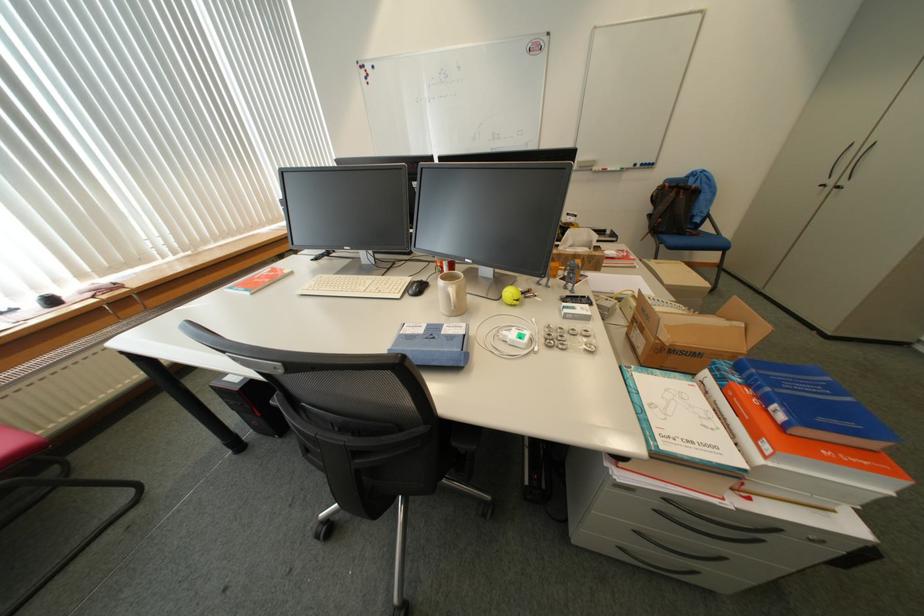
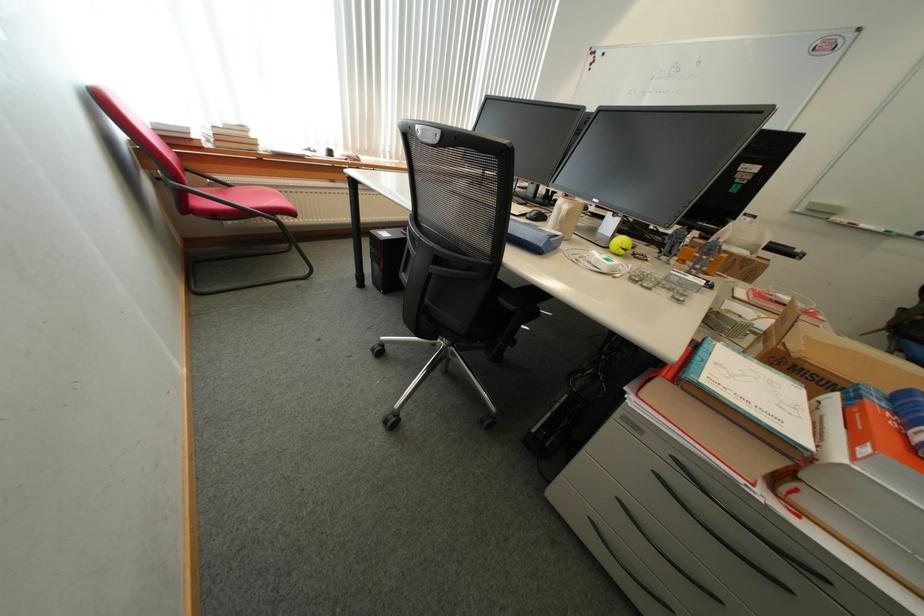
Find the pixel in the second image that matches pixel 764 439 in the first image.

(864, 446)